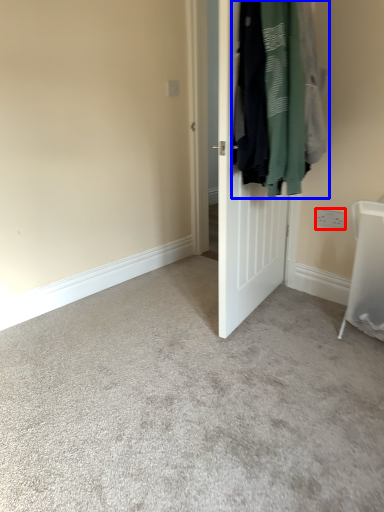
Question: Which object appears closest to the camera in this image, electric outlet (highlighted by a red box) or laundry (highlighted by a blue box)?

Choices:
 (A) electric outlet
 (B) laundry

Answer: (B)